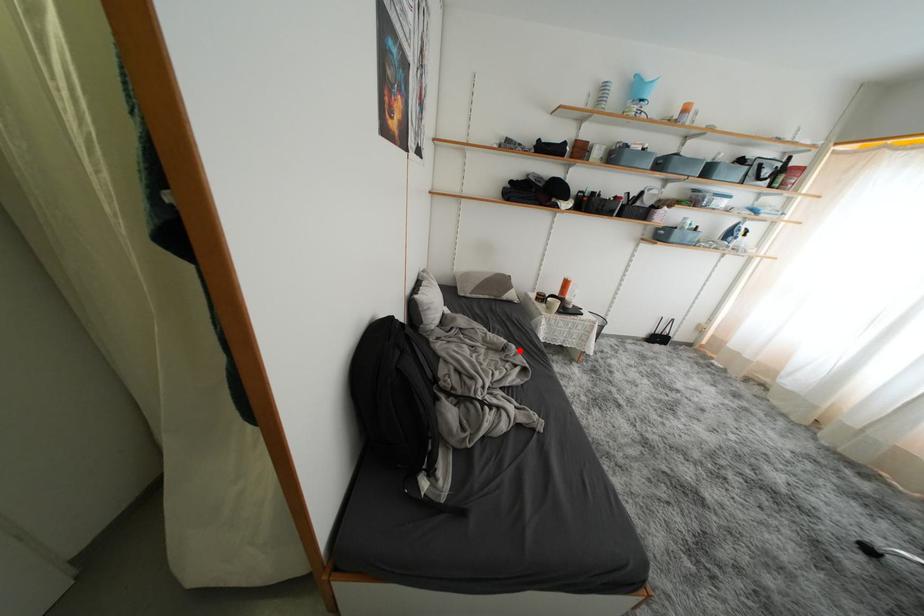
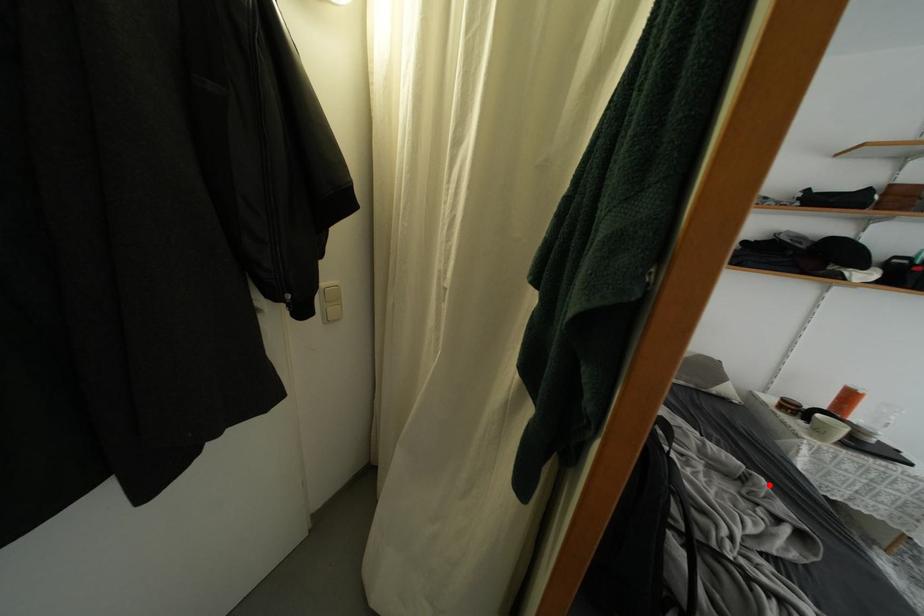
Consider the image. I am providing you with two images of the same scene from different viewpoints. A red point is marked on the first image and another point is marked on the second image. Are the points marked in image1 and image2 representing the same 3D position?

Yes